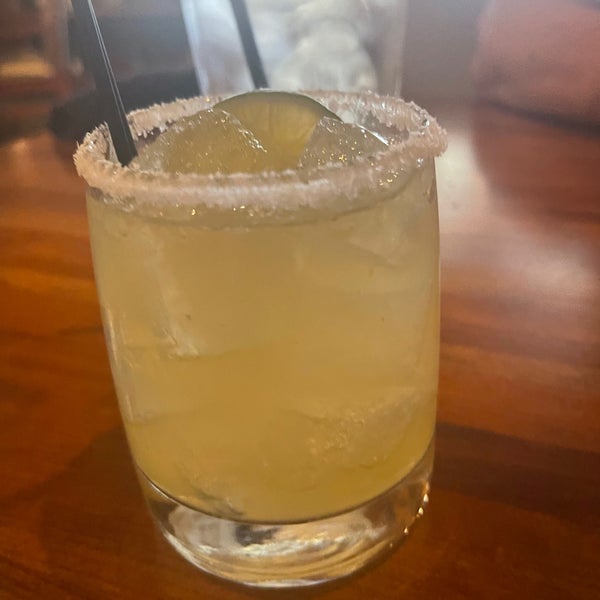
The image size is (600, 600). Find the location of `table`. table is located at coordinates (90, 552).